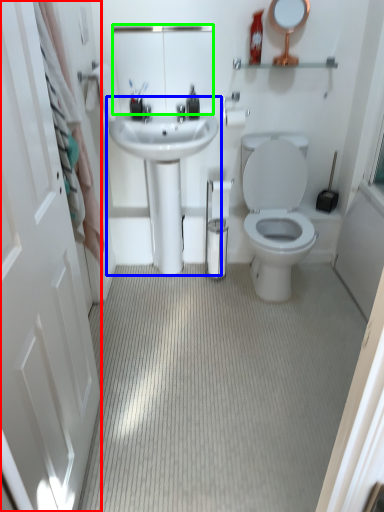
Question: Based on their relative distances, which object is nearer to screen door (highlighted by a red box)? Choose from sink (highlighted by a blue box) and mirror (highlighted by a green box).

Choices:
 (A) sink
 (B) mirror

Answer: (A)